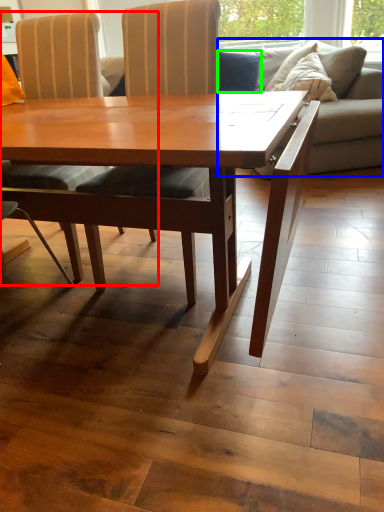
Question: Estimate the real-world distances between objects in this image. Which object is farther from chair (highlighted by a red box), studio couch (highlighted by a blue box) or pillow (highlighted by a green box)?

Choices:
 (A) studio couch
 (B) pillow

Answer: (B)